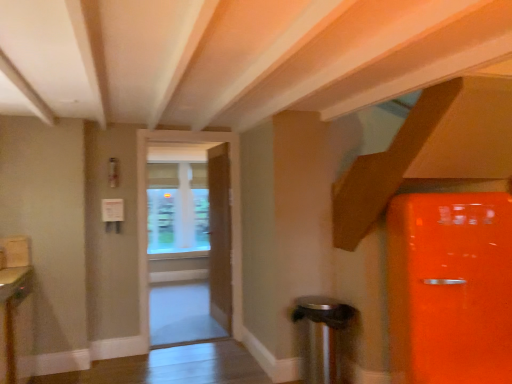
Question: Is wooden door at center, the 1th door from the back, with transparent glass window at center?

Choices:
 (A) yes
 (B) no

Answer: (B)

Question: Considering the relative positions of wooden door at center, the 1th door from the back, and transparent glass window at center in the image provided, is wooden door at center, the 1th door from the back, in front of transparent glass window at center?

Choices:
 (A) no
 (B) yes

Answer: (B)

Question: Can you confirm if wooden door at center, the 2th door when ordered from front to back, is positioned to the left of transparent glass window at center?

Choices:
 (A) yes
 (B) no

Answer: (B)

Question: Can you confirm if wooden door at center, the 2th door when ordered from front to back, is smaller than transparent glass window at center?

Choices:
 (A) no
 (B) yes

Answer: (B)

Question: From the image's perspective, is wooden door at center, the 2th door when ordered from front to back, on top of transparent glass window at center?

Choices:
 (A) no
 (B) yes

Answer: (A)

Question: From the image's perspective, is wooden door at center, the 1th door from the back, positioned above or below matte wood cabinet at lower left?

Choices:
 (A) above
 (B) below

Answer: (A)

Question: Considering their positions, is wooden door at center, the 2th door when ordered from front to back, located in front of or behind matte wood cabinet at lower left?

Choices:
 (A) front
 (B) behind

Answer: (B)

Question: Is wooden door at center, the 2th door when ordered from front to back, to the left or to the right of matte wood cabinet at lower left in the image?

Choices:
 (A) left
 (B) right

Answer: (B)

Question: Considering the positions of point (217, 288) and point (4, 347), is point (217, 288) closer or farther from the camera than point (4, 347)?

Choices:
 (A) farther
 (B) closer

Answer: (A)

Question: Considering the positions of wooden door at center, the 2th door when ordered from front to back, and transparent glass window at center in the image, is wooden door at center, the 2th door when ordered from front to back, bigger or smaller than transparent glass window at center?

Choices:
 (A) small
 (B) big

Answer: (A)

Question: Does point (229, 324) appear closer or farther from the camera than point (165, 235)?

Choices:
 (A) farther
 (B) closer

Answer: (B)

Question: From a real-world perspective, relative to transparent glass window at center, is wooden door at center, the 1th door from the back, vertically above or below?

Choices:
 (A) above
 (B) below

Answer: (B)

Question: From their relative heights in the image, would you say wooden door at center, the 1th door from the back, is taller or shorter than transparent glass window at center?

Choices:
 (A) short
 (B) tall

Answer: (B)

Question: In terms of width, does matte wood cabinet at lower left look wider or thinner when compared to satin silver trash can at lower right?

Choices:
 (A) thin
 (B) wide

Answer: (A)

Question: Would you say matte wood cabinet at lower left is to the left or to the right of satin silver trash can at lower right in the picture?

Choices:
 (A) left
 (B) right

Answer: (A)